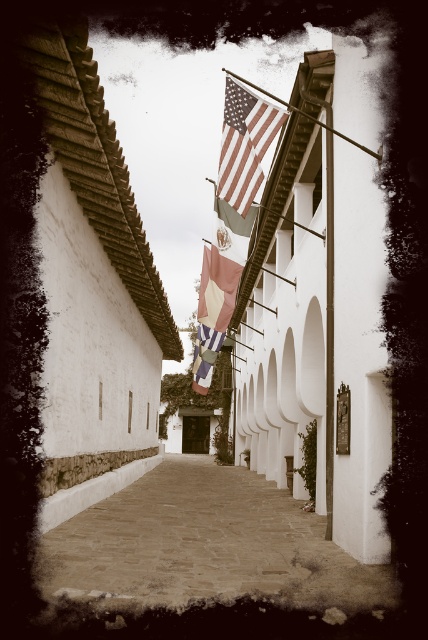
Is point (163, 598) behind point (226, 324)?

That is False.

The image size is (428, 640). What do you see at coordinates (207, 545) in the screenshot? I see `smooth stone alley at center` at bounding box center [207, 545].

Locate an element on the screen. This screenshot has width=428, height=640. smooth stone alley at center is located at coordinates coord(207,545).

The height and width of the screenshot is (640, 428). I want to click on smooth stone alley at center, so click(207, 545).

In the scene shown: Who is more forward, (273, 547) or (237, 80)?

Point (273, 547)

Does smooth stone alley at center have a greater width compared to metallic flag pole at upper center?

Indeed, smooth stone alley at center has a greater width compared to metallic flag pole at upper center.

The image size is (428, 640). What are the coordinates of `smooth stone alley at center` in the screenshot? It's located at 207,545.

Who is more forward, (318, 572) or (232, 189)?

Positioned in front is point (318, 572).

Consider the image. Does smooth stone alley at center have a greater height compared to american flag at upper center?

Correct, smooth stone alley at center is much taller as american flag at upper center.

Which is in front, point (122, 592) or point (235, 156)?

Positioned in front is point (122, 592).

Where is `smooth stone alley at center`? smooth stone alley at center is located at coordinates (207, 545).